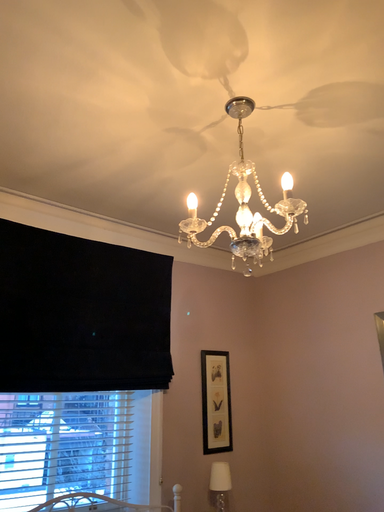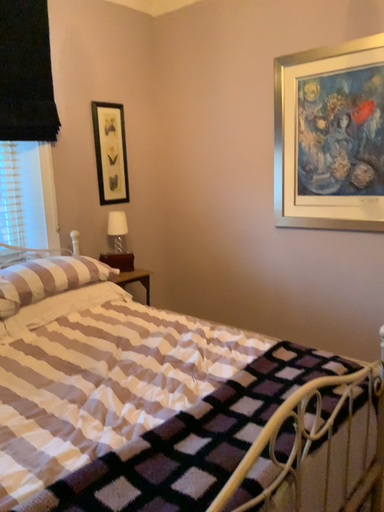
Question: How did the camera likely rotate when shooting the video?

Choices:
 (A) rotated left
 (B) rotated right

Answer: (B)